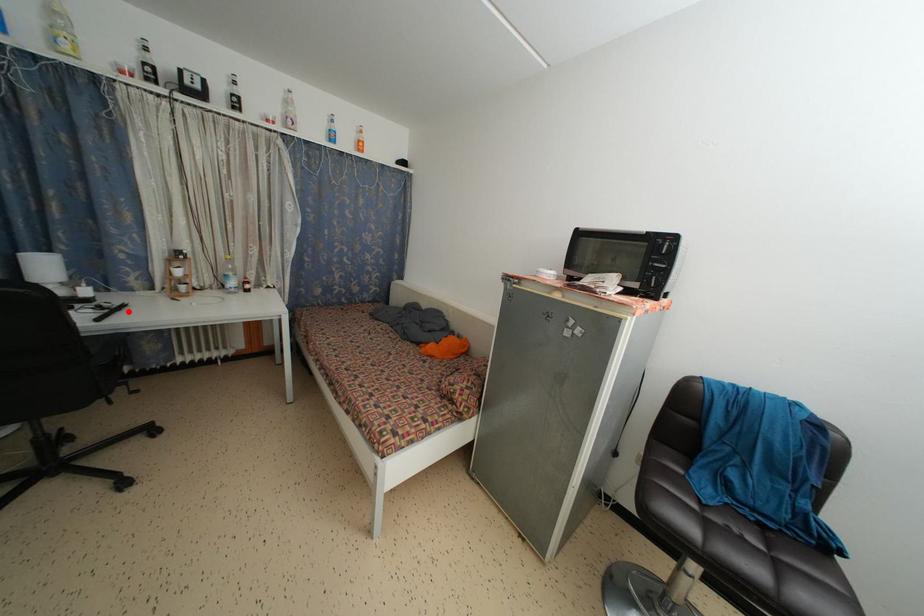
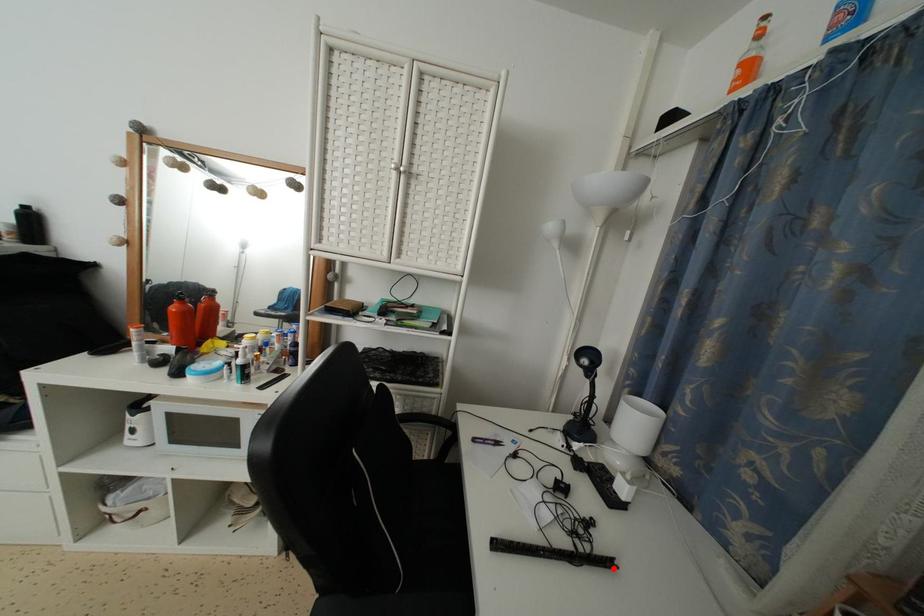
I am providing you with two images of the same scene from different viewpoints. A red point is marked on the first image and another point is marked on the second image. Are the points marked in image1 and image2 representing the same 3D position?

Yes